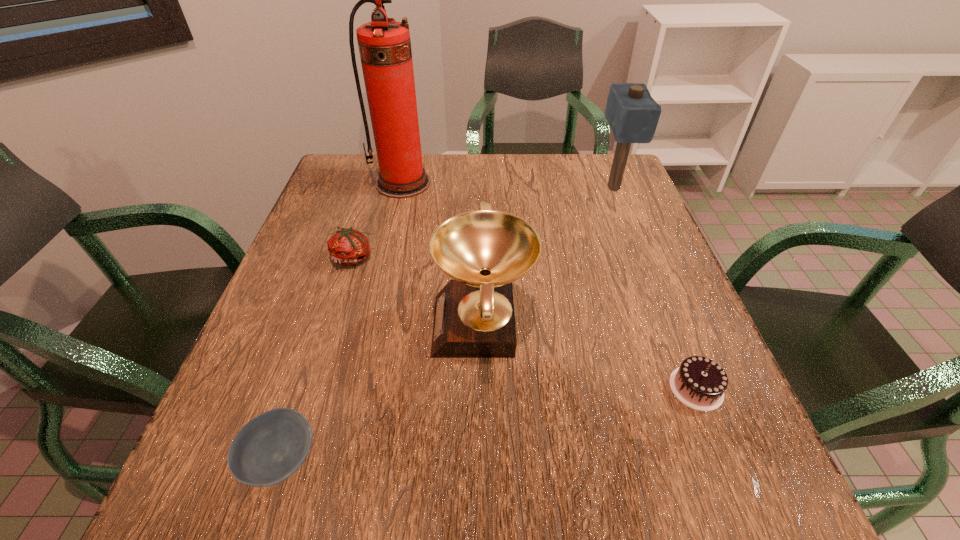
This screenshot has height=540, width=960. What are the coordinates of `vacant region at the right edge of the desktop` in the screenshot? It's located at (736, 401).

Find the location of a particular element. vacant area at the far left corner is located at coordinates (347, 185).

The height and width of the screenshot is (540, 960). Identify the location of free point between the bowl and the fire extinguisher. (342, 321).

Image resolution: width=960 pixels, height=540 pixels. Identify the location of free spot between the chocolate cake and the mallet. (655, 288).

Where is `empty space that is in between the chocolate cake and the bowl`? empty space that is in between the chocolate cake and the bowl is located at coordinates [489, 424].

Identify the location of blank region between the shortest object and the third farthest object. The height and width of the screenshot is (540, 960). (317, 359).

Where is `vacant area that lies between the chocolate cake and the tomato`? vacant area that lies between the chocolate cake and the tomato is located at coordinates (525, 323).

I want to click on free point between the fourth nearest object and the third tallest object, so coord(419,292).

The height and width of the screenshot is (540, 960). Identify the location of unoccupied area between the award and the nearest object. (382, 393).

Locate an element on the screen. The image size is (960, 540). vacant space in between the fire extinguisher and the fifth shortest object is located at coordinates (508, 185).